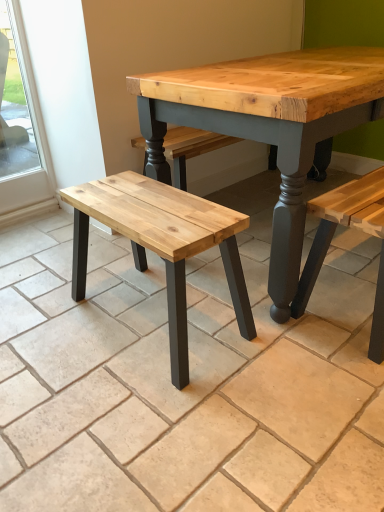
I want to click on vacant space underneath natural wood bench at left (from a real-world perspective), so click(163, 316).